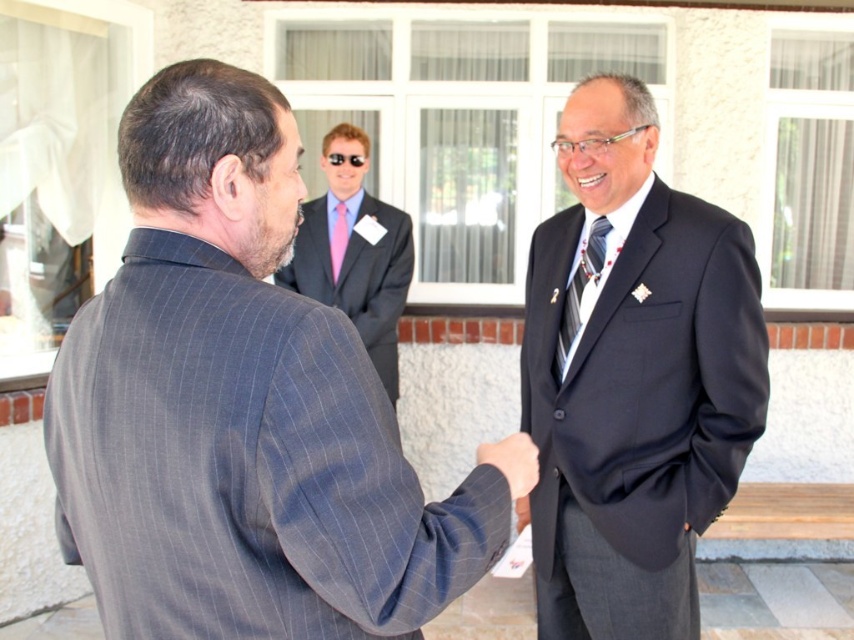
Question: Which object appears farthest from the camera in this image?

Choices:
 (A) matte pink tie at center
 (B) smooth leather hand at center

Answer: (A)

Question: Among these points, which one is nearest to the camera?

Choices:
 (A) (320, 145)
 (B) (563, 314)
 (C) (329, 248)

Answer: (B)

Question: Is the position of gray pinstripe suit at center more distant than that of dark blue suit at center?

Choices:
 (A) no
 (B) yes

Answer: (A)

Question: Is gray pinstripe suit at center smaller than smooth leather hand at center?

Choices:
 (A) no
 (B) yes

Answer: (A)

Question: Considering the real-world distances, which object is farthest from the pink silk tie at center?

Choices:
 (A) gray pinstripe suit at center
 (B) matte pink tie at center
 (C) dark blue suit at center

Answer: (A)

Question: Is the position of dark blue suit at center more distant than that of matte pink tie at center?

Choices:
 (A) yes
 (B) no

Answer: (B)